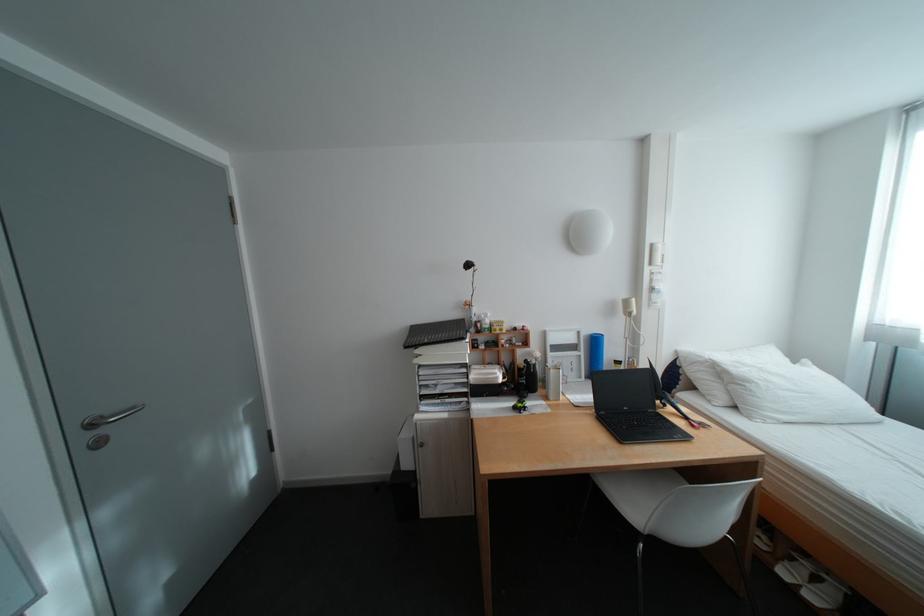
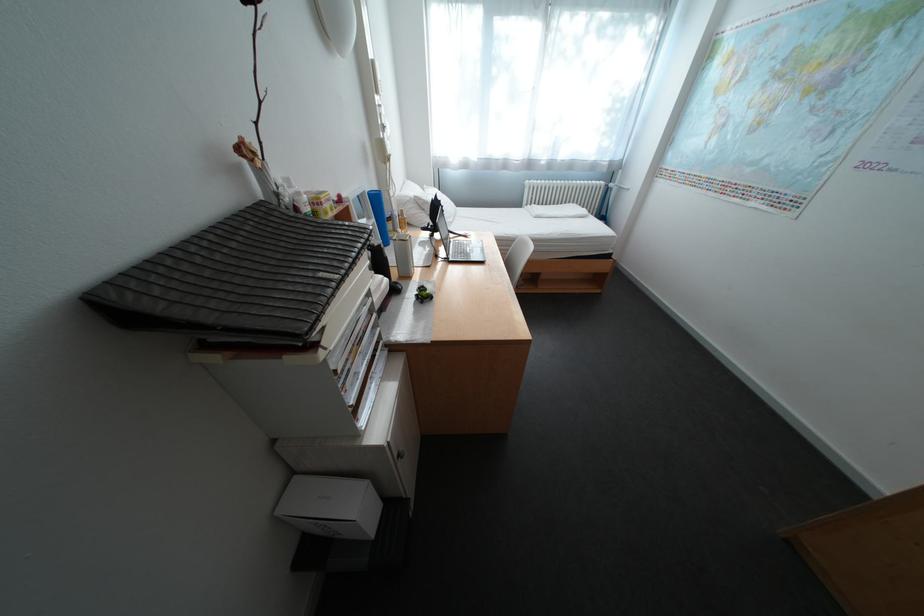
Find the pixel in the second image that matches point (699, 419) in the first image.

(472, 236)